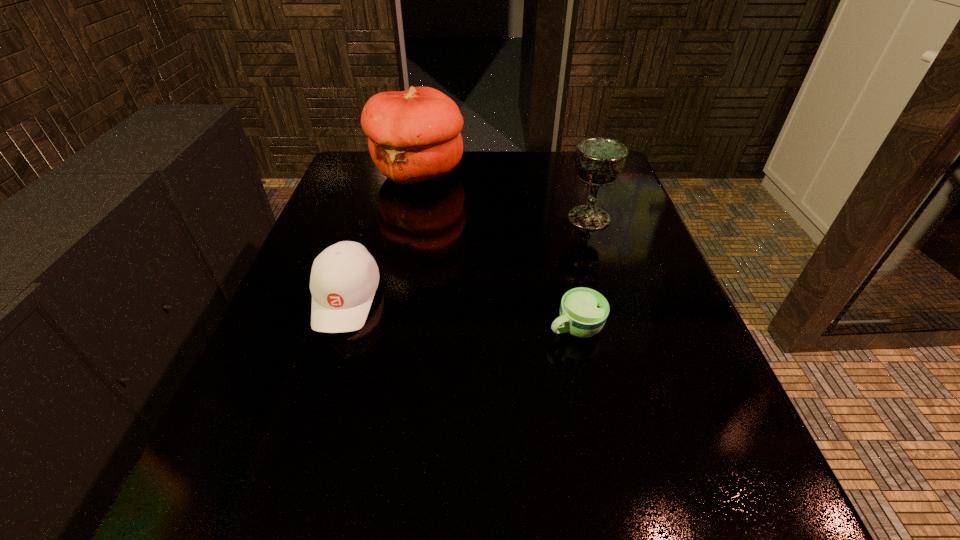
Find the location of a particular element. The width and height of the screenshot is (960, 540). object positioned at the far edge is located at coordinates (414, 135).

Image resolution: width=960 pixels, height=540 pixels. I want to click on pumpkin present at the left edge, so click(414, 135).

The image size is (960, 540). What are the coordinates of `baseball cap that is at the left edge` in the screenshot? It's located at (344, 277).

Identify the location of chalice present at the right edge. (599, 161).

Where is `cup present at the right edge`? This screenshot has width=960, height=540. cup present at the right edge is located at coordinates (583, 311).

Identify the location of object that is at the far left corner. (414, 135).

Locate an element on the screen. vacant area at the far edge of the desktop is located at coordinates (555, 175).

In the image, there is a desktop. Where is `vacant space at the left edge`? Image resolution: width=960 pixels, height=540 pixels. vacant space at the left edge is located at coordinates (377, 195).

At what (x,y) coordinates should I click in order to perform the action: click on vacant area at the right edge. Please return your answer as a coordinate pair (x, y). This screenshot has height=540, width=960. Looking at the image, I should click on (639, 219).

This screenshot has width=960, height=540. Identify the location of vacant region at the far left corner of the desktop. (353, 183).